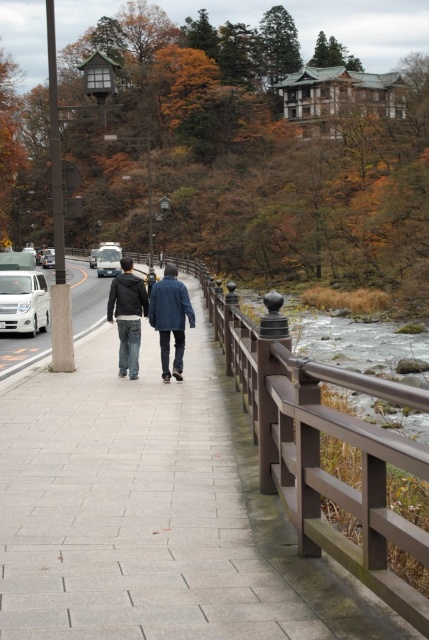
Is brown wooden railing at center-right taller than metallic silver bus at center?

No, brown wooden railing at center-right is not taller than metallic silver bus at center.

Who is positioned more to the right, brown wooden railing at center-right or metallic silver bus at center?

Positioned to the right is brown wooden railing at center-right.

Which is behind, point (45, 509) or point (114, 257)?

Point (114, 257)

Identify the location of brown wooden railing at center-right. The image size is (429, 640). (24, 531).

Who is lower down, brown wooden railing at lower right or blue fabric coat at center?

Positioned lower is blue fabric coat at center.

Does brown wooden railing at lower right appear on the right side of blue fabric coat at center?

Indeed, brown wooden railing at lower right is positioned on the right side of blue fabric coat at center.

Between point (296, 339) and point (151, 292), which one is positioned behind?

Positioned behind is point (296, 339).

Where is `brown wooden railing at lower right`? This screenshot has height=640, width=429. brown wooden railing at lower right is located at coordinates (355, 342).

Can you confirm if blue fabric coat at center is positioned to the right of dark gray jacket at center?

Indeed, blue fabric coat at center is positioned on the right side of dark gray jacket at center.

Does blue fabric coat at center have a greater width compared to dark gray jacket at center?

In fact, blue fabric coat at center might be narrower than dark gray jacket at center.

Is point (178, 332) in front of point (141, 280)?

Yes, it is in front of point (141, 280).

Identify the location of blue fabric coat at center. The height and width of the screenshot is (640, 429). (171, 317).